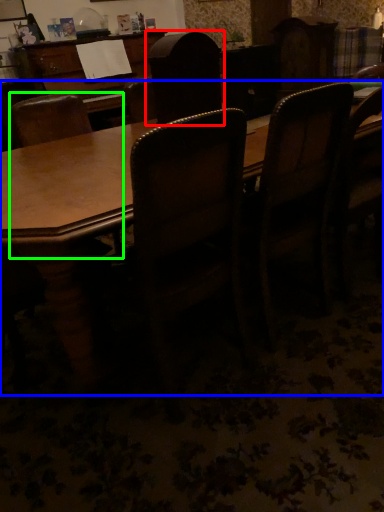
Question: Which object is the farthest from chair (highlighted by a red box)? Choose among these: table (highlighted by a blue box) or chair (highlighted by a green box).

Choices:
 (A) table
 (B) chair

Answer: (B)